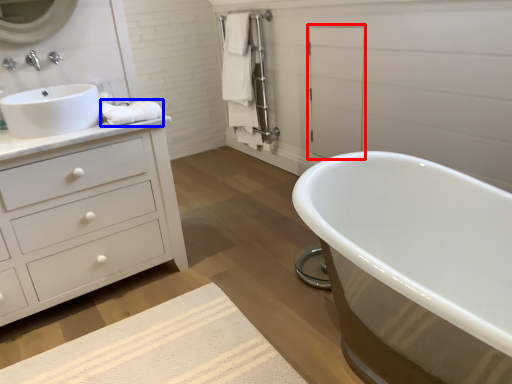
Question: Among these objects, which one is nearest to the camera, screen door (highlighted by a red box) or material (highlighted by a blue box)?

Choices:
 (A) screen door
 (B) material

Answer: (B)